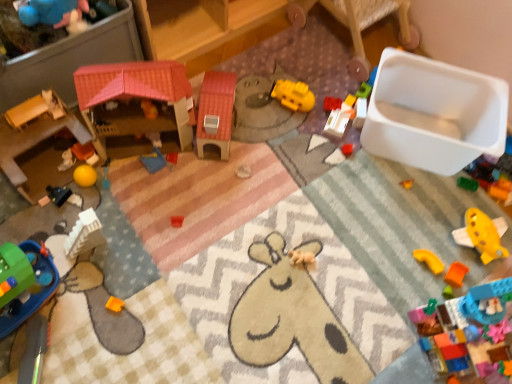
Find the location of a particular element. free space that is in between yellow plastic airplane at lower right, arranged as the 15th toy when viewed from the left, and plastic pink house at center, positioned as the 9th toy in right-to-left order is located at coordinates (313, 190).